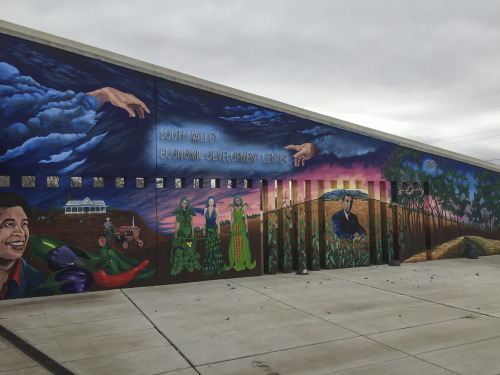
At what (x,y) coordinates should I click in order to perform the action: click on hole in the wall in the center. Please return your answer as a coordinate pair (x, y). Looking at the image, I should click on (213, 182).